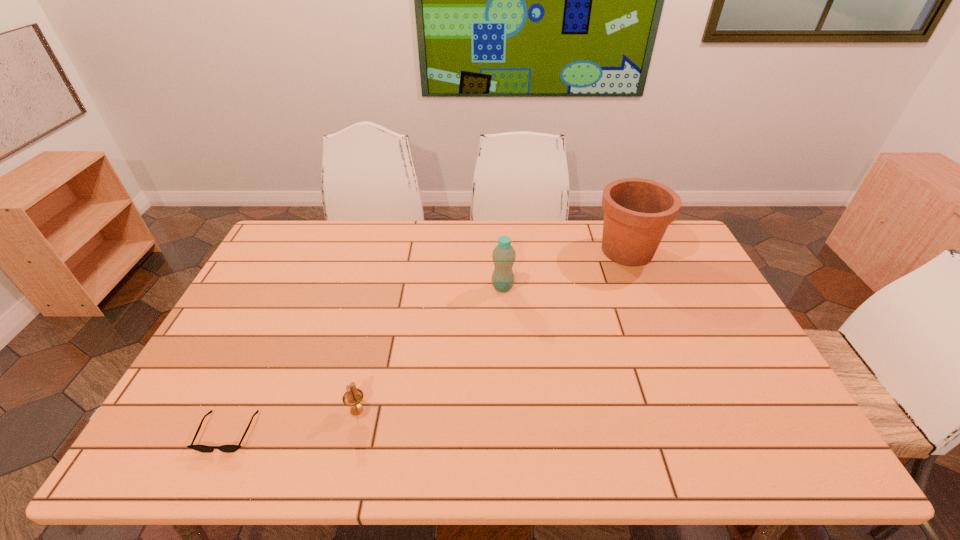
The width and height of the screenshot is (960, 540). I want to click on the rightmost object, so click(x=637, y=212).

The image size is (960, 540). Identify the location of flowerpot. (637, 212).

The width and height of the screenshot is (960, 540). Find the location of `water bottle`. water bottle is located at coordinates (503, 255).

Locate an element on the screen. the second tallest object is located at coordinates (503, 255).

At what (x,y) coordinates should I click in order to perform the action: click on the third object from right to left. Please return your answer as a coordinate pair (x, y). The width and height of the screenshot is (960, 540). Looking at the image, I should click on (352, 398).

The width and height of the screenshot is (960, 540). In order to click on candle holder in this screenshot , I will do `click(352, 398)`.

The image size is (960, 540). In order to click on the shortest object in this screenshot , I will do `click(201, 448)`.

Find the location of a particular element. sunglasses is located at coordinates (201, 448).

I want to click on free location located 0.340m on the left of the farthest object, so click(x=495, y=251).

Find the location of `free space located 0.060m at the front cap of the water bottle`. free space located 0.060m at the front cap of the water bottle is located at coordinates (472, 287).